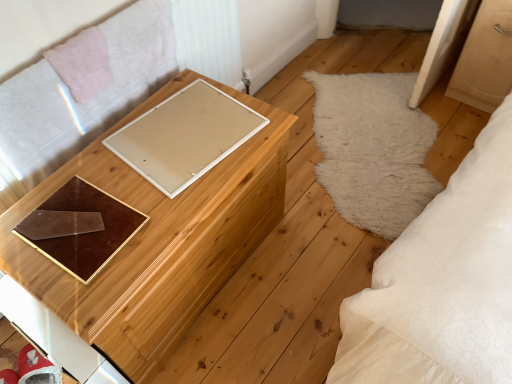
Locate an element on the screen. vacant region below beige matte board at center (from a real-world perspective) is located at coordinates (182, 128).